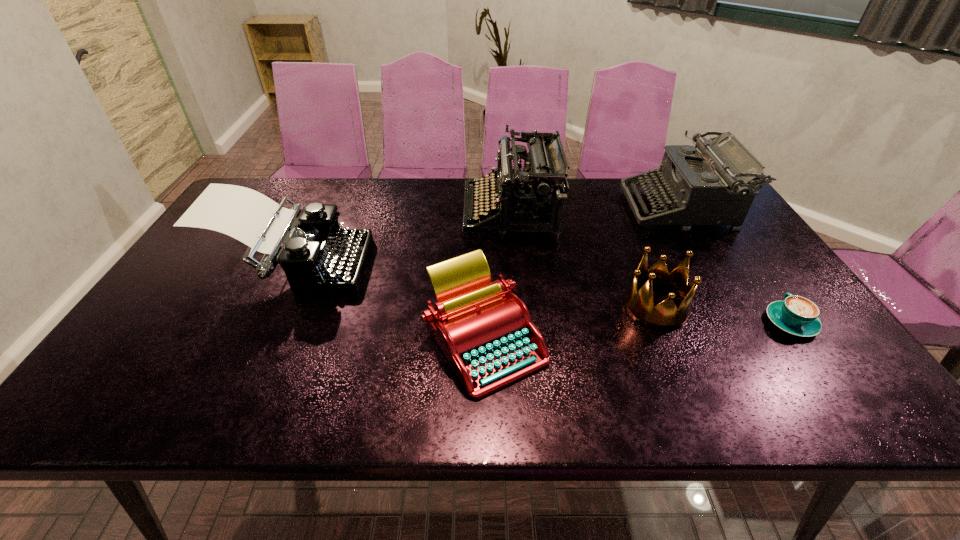
Where is `free spot located 0.110m with the handle on the right side of the shortest object`? The width and height of the screenshot is (960, 540). free spot located 0.110m with the handle on the right side of the shortest object is located at coordinates (758, 276).

Locate an element on the screen. blank area located 0.340m with the handle on the right side of the shortest object is located at coordinates (724, 226).

What are the coordinates of `vacant space located 0.210m with the handle on the right side of the shortest object` in the screenshot? It's located at (742, 253).

Locate an element on the screen. The image size is (960, 540). object at the near edge is located at coordinates (486, 333).

Identify the location of object that is at the left edge. The height and width of the screenshot is (540, 960). (317, 255).

You are a GUI agent. You are given a task and a screenshot of the screen. Output one action in this format:
    pyautogui.click(x=<x>, y=<y>)
    Task: Click on the typewriter at the right edge
    This screenshot has height=540, width=960.
    Given the screenshot: What is the action you would take?
    (709, 184)

You are a GUI agent. You are given a task and a screenshot of the screen. Output one action in this format:
    pyautogui.click(x=<x>, y=<y>)
    Task: Click on the cappuccino located at the right edge
    The image size is (960, 540).
    Given the screenshot: What is the action you would take?
    pyautogui.click(x=796, y=315)

At what (x,y) coordinates should I click in order to perform the action: click on object located at the far right corner. Please return your answer as a coordinate pair (x, y). The image size is (960, 540). Looking at the image, I should click on (709, 184).

Where is `free space at the far edge`? free space at the far edge is located at coordinates (440, 184).

In the image, there is a desktop. Where is `blank space at the near edge`? The image size is (960, 540). blank space at the near edge is located at coordinates (461, 388).